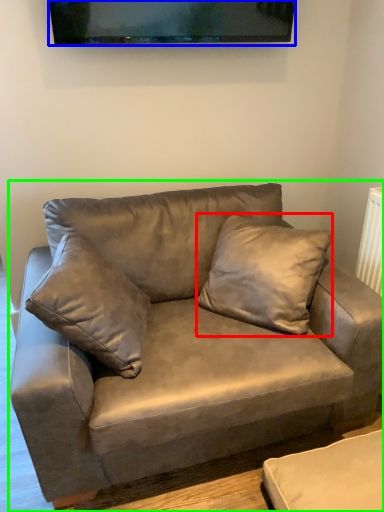
Question: Estimate the real-world distances between objects in this image. Which object is farther from pillow (highlighted by a red box), television (highlighted by a blue box) or studio couch (highlighted by a green box)?

Choices:
 (A) television
 (B) studio couch

Answer: (A)